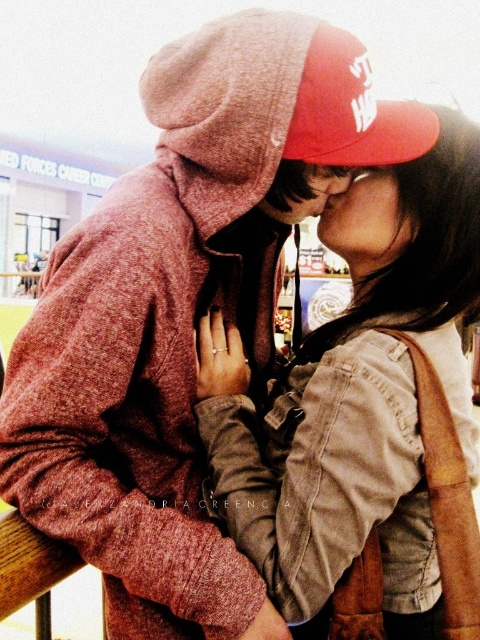
Does matte brown jacket at center have a smaller size compared to red cotton baseball cap at upper center?

Incorrect, matte brown jacket at center is not smaller in size than red cotton baseball cap at upper center.

Which is behind, point (435, 412) or point (265, 152)?

The point (435, 412) is more distant.

Where is `matte brown jacket at center`? This screenshot has height=640, width=480. matte brown jacket at center is located at coordinates (365, 417).